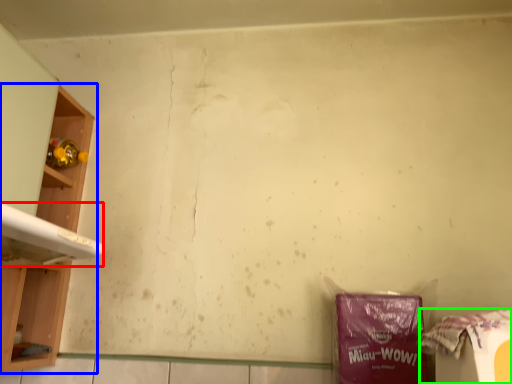
Question: Which is nearer to the washing (highlighted by a red box)? shelf (highlighted by a blue box) or waste (highlighted by a green box).

Choices:
 (A) shelf
 (B) waste

Answer: (A)